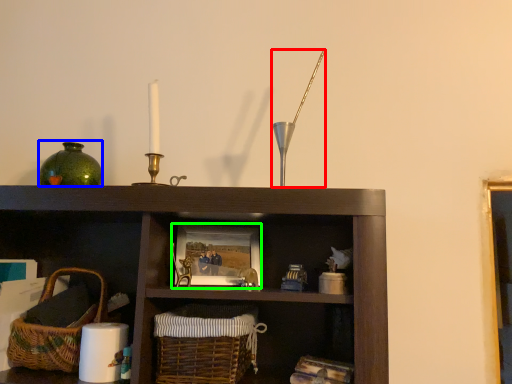
Question: Which object is the closest to the candle holder (highlighted by a red box)? Choose among these: glass vase (highlighted by a blue box) or picture frame (highlighted by a green box).

Choices:
 (A) glass vase
 (B) picture frame

Answer: (B)